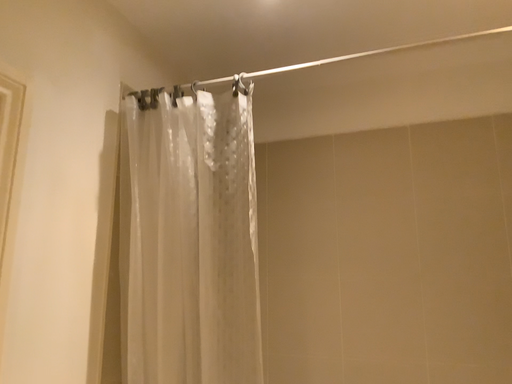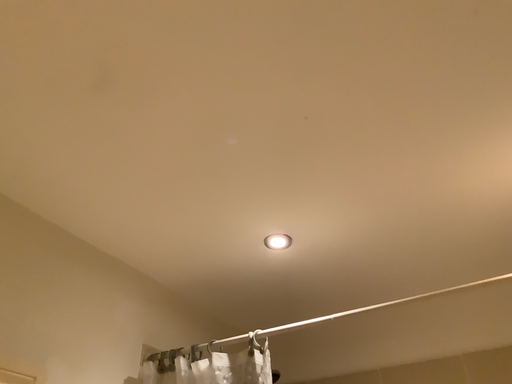
Question: Which way did the camera rotate in the video?

Choices:
 (A) rotated upward
 (B) rotated downward

Answer: (A)